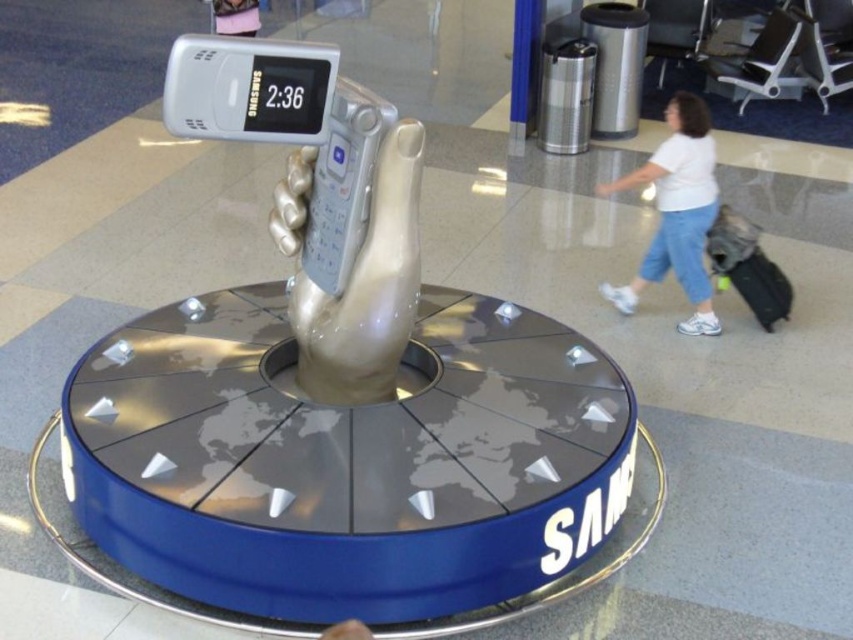
Is the position of white cotton shirt at upper right less distant than that of black fabric suitcase at right?

Yes, it is.

Which is more to the left, white cotton shirt at upper right or black fabric suitcase at right?

white cotton shirt at upper right is more to the left.

What do you see at coordinates (676, 212) in the screenshot? I see `white cotton shirt at upper right` at bounding box center [676, 212].

Find the location of a particular element. white cotton shirt at upper right is located at coordinates (676, 212).